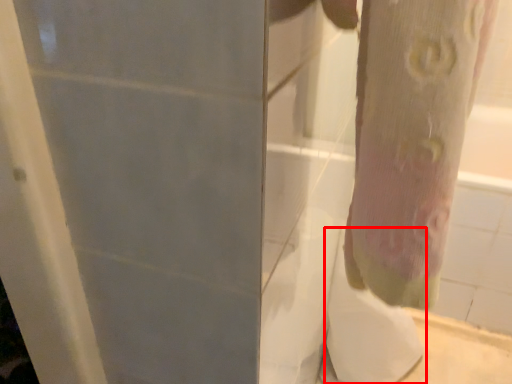
Question: From the image's perspective, what is the correct spatial positioning of toilet paper (annotated by the red box) in reference to tree trunk?

Choices:
 (A) above
 (B) below

Answer: (B)